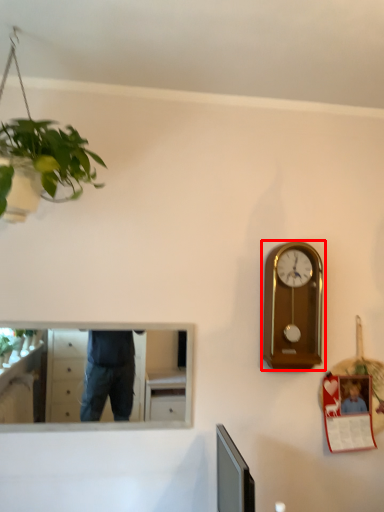
Question: From the image's perspective, what is the correct spatial relationship of wall clock (annotated by the red box) in relation to mirror?

Choices:
 (A) above
 (B) below

Answer: (A)